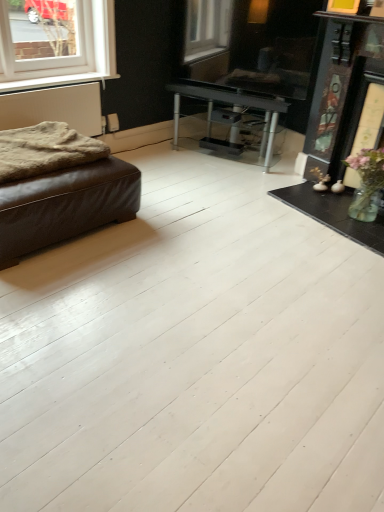
Question: Can you confirm if white textured radiator at left is taller than fuzzy woolen blanket at left?

Choices:
 (A) no
 (B) yes

Answer: (B)

Question: Can you confirm if white textured radiator at left is thinner than fuzzy woolen blanket at left?

Choices:
 (A) no
 (B) yes

Answer: (B)

Question: Does white textured radiator at left have a larger size compared to fuzzy woolen blanket at left?

Choices:
 (A) no
 (B) yes

Answer: (A)

Question: Is white textured radiator at left shorter than fuzzy woolen blanket at left?

Choices:
 (A) no
 (B) yes

Answer: (A)

Question: Is white textured radiator at left located outside fuzzy woolen blanket at left?

Choices:
 (A) yes
 (B) no

Answer: (A)

Question: Is brown leather ottoman at left in front of or behind fuzzy woolen blanket at left in the image?

Choices:
 (A) behind
 (B) front

Answer: (B)

Question: Which is correct: brown leather ottoman at left is inside fuzzy woolen blanket at left, or outside of it?

Choices:
 (A) outside
 (B) inside

Answer: (A)

Question: Does point (41, 161) appear closer or farther from the camera than point (26, 147)?

Choices:
 (A) farther
 (B) closer

Answer: (B)

Question: Is brown leather ottoman at left taller or shorter than fuzzy woolen blanket at left?

Choices:
 (A) tall
 (B) short

Answer: (A)

Question: Is white textured radiator at left to the left or to the right of fuzzy woolen blanket at left in the image?

Choices:
 (A) left
 (B) right

Answer: (A)

Question: In terms of width, does white textured radiator at left look wider or thinner when compared to fuzzy woolen blanket at left?

Choices:
 (A) thin
 (B) wide

Answer: (A)

Question: Is white textured radiator at left bigger or smaller than fuzzy woolen blanket at left?

Choices:
 (A) small
 (B) big

Answer: (A)

Question: Is white textured radiator at left inside or outside of fuzzy woolen blanket at left?

Choices:
 (A) outside
 (B) inside

Answer: (A)

Question: Looking at the image, does white matte window sill at upper left seem bigger or smaller compared to fuzzy woolen blanket at left?

Choices:
 (A) small
 (B) big

Answer: (A)

Question: Considering the positions of white matte window sill at upper left and fuzzy woolen blanket at left in the image, is white matte window sill at upper left wider or thinner than fuzzy woolen blanket at left?

Choices:
 (A) wide
 (B) thin

Answer: (B)